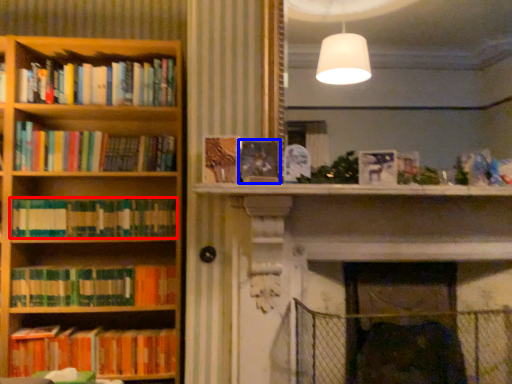
Question: Which of the following is the closest to the observer, book (highlighted by a red box) or book (highlighted by a blue box)?

Choices:
 (A) book
 (B) book

Answer: (B)